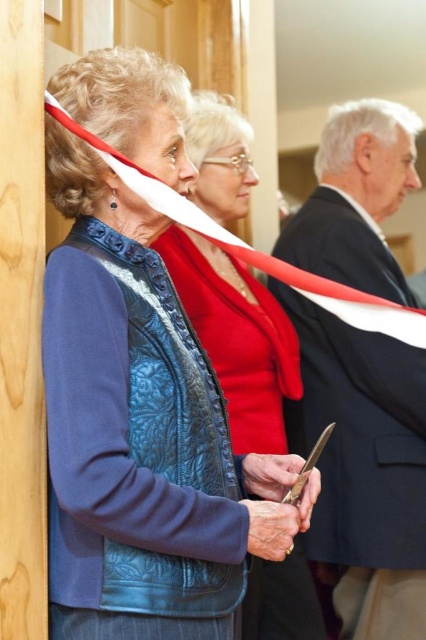
From the picture: Who is positioned more to the right, dark gray suit at right or blue quilted leather jacket at center?

Positioned to the right is dark gray suit at right.

Who is shorter, dark gray suit at right or blue quilted leather jacket at center?

Standing shorter between the two is blue quilted leather jacket at center.

Which is in front, point (417, 481) or point (265, 573)?

Point (265, 573)

Where is `dark gray suit at right`? The height and width of the screenshot is (640, 426). dark gray suit at right is located at coordinates (365, 468).